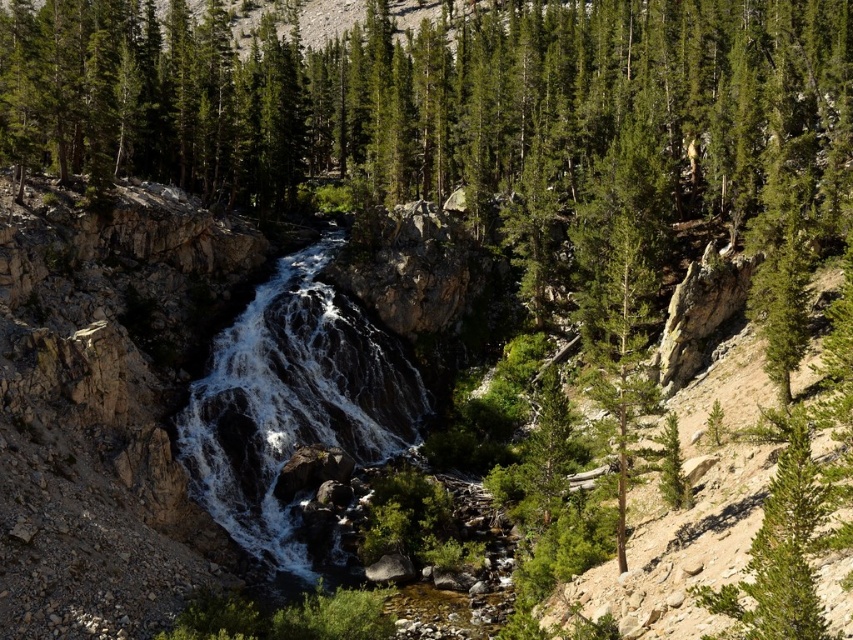
Does point (289, 406) come behind point (599, 292)?

No, it is in front of (599, 292).

Who is more distant from viewer, [306,384] or [614,328]?

The point [306,384] is behind.

At what (x,y) coordinates should I click in order to perform the action: click on white frothy water at center. Please return your answer as a coordinate pair (x, y). Looking at the image, I should click on (292, 401).